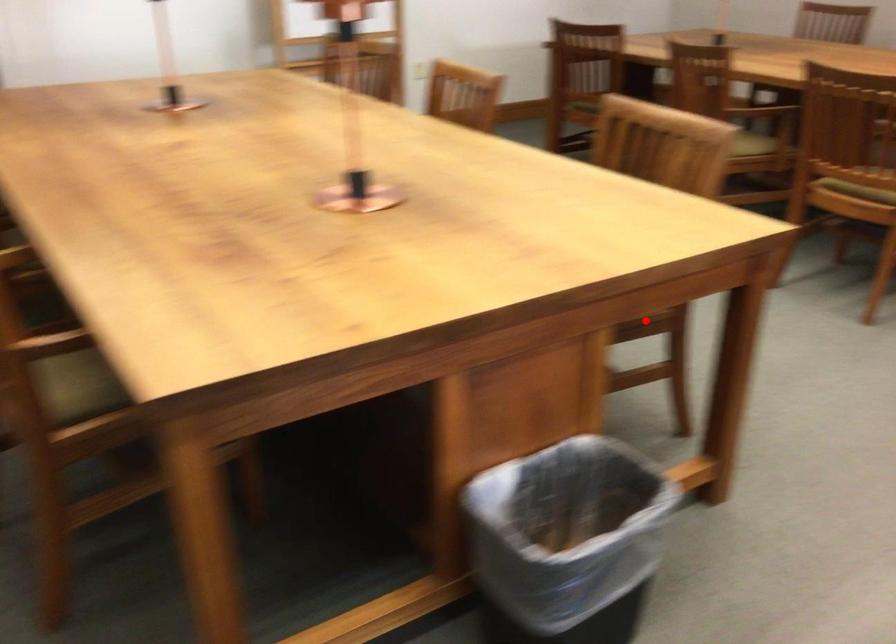
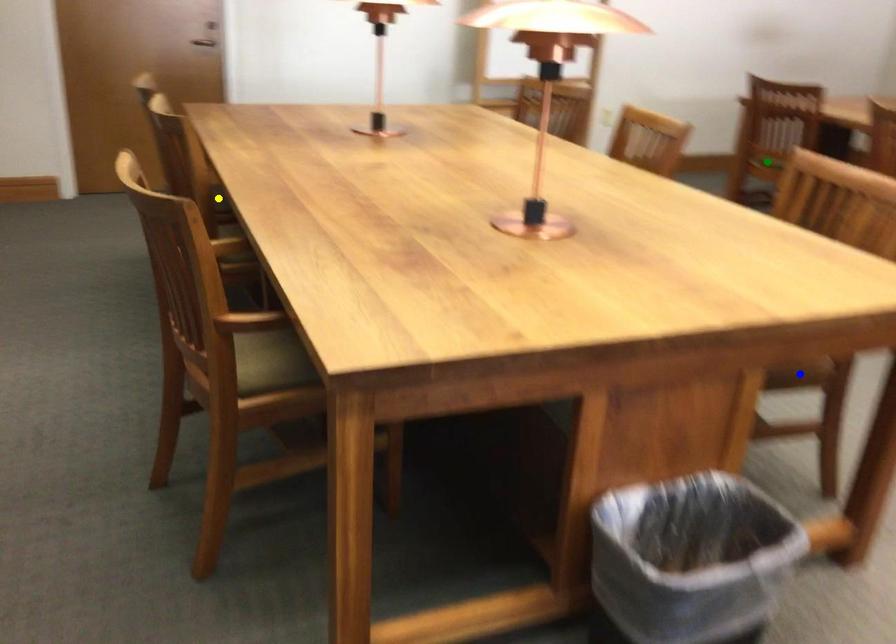
Question: I am providing you with two images of the same scene from different viewpoints. A red point is marked on the first image. You are given multiple points on the second image. In image 2, which mark is for the same physical point as the one in image 1?

Choices:
 (A) blue point
 (B) green point
 (C) yellow point

Answer: (A)